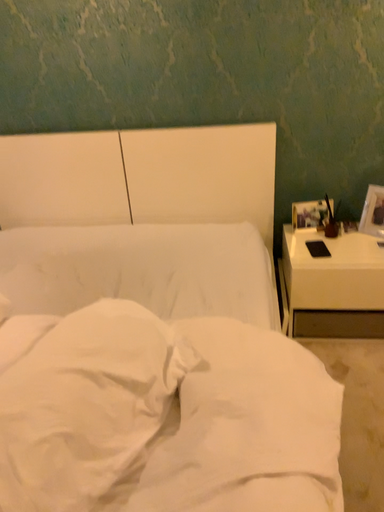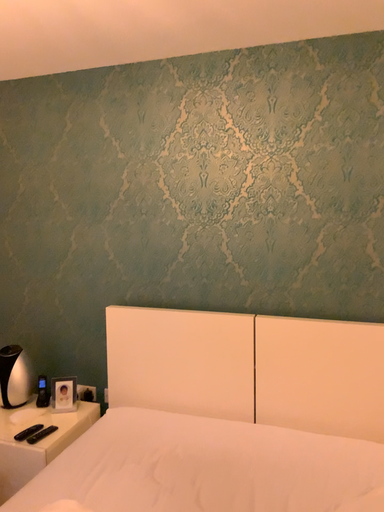
Question: Which way did the camera rotate in the video?

Choices:
 (A) rotated upward
 (B) rotated downward

Answer: (A)